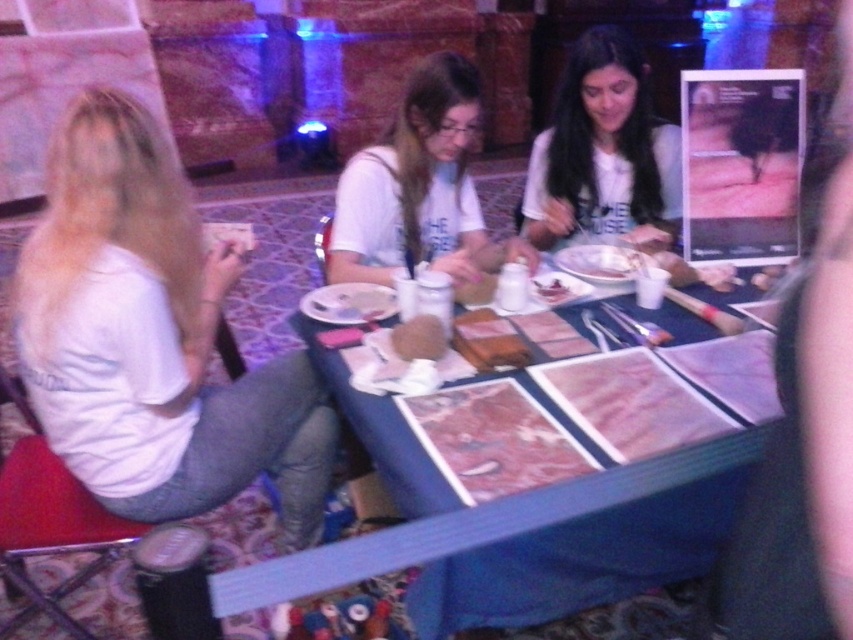
Who is more forward, (73, 204) or (546, 280)?

Point (73, 204) is in front.

Based on the photo, does white matte shirt at left have a lesser width compared to slightly browned bread at center?

Incorrect, white matte shirt at left's width is not less than slightly browned bread at center's.

Where is `white matte shirt at left`? white matte shirt at left is located at coordinates (152, 339).

The height and width of the screenshot is (640, 853). Describe the element at coordinates (152, 339) in the screenshot. I see `white matte shirt at left` at that location.

What do you see at coordinates (152, 339) in the screenshot?
I see `white matte shirt at left` at bounding box center [152, 339].

Locate an element on the screen. The width and height of the screenshot is (853, 640). white matte shirt at left is located at coordinates (152, 339).

Does white matte shirt at left have a larger size compared to white matte shirt at upper center?

Yes.

Locate an element on the screen. white matte shirt at left is located at coordinates (152, 339).